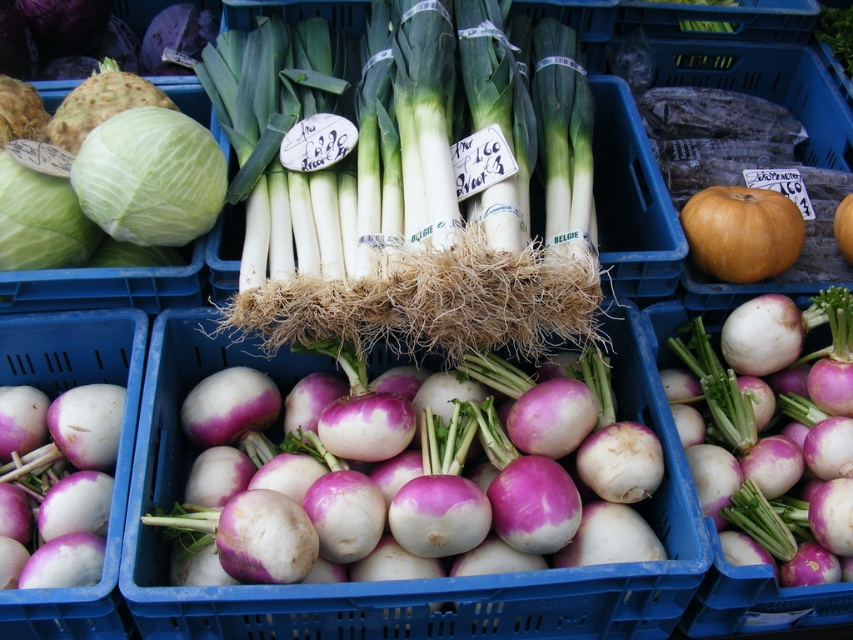
Is purple matte turnip at center closer to the viewer compared to green matte cabbage at upper left?

Yes, purple matte turnip at center is in front of green matte cabbage at upper left.

Between purple matte turnip at center and green matte cabbage at upper left, which one has less height?

Standing shorter between the two is green matte cabbage at upper left.

Is point (779, 497) more distant than point (77, 260)?

That is False.

This screenshot has width=853, height=640. I want to click on purple matte turnip at center, so pos(776,442).

Is purple matte turnip at center above matte orange pumpkin at center?

Actually, purple matte turnip at center is below matte orange pumpkin at center.

Does purple matte turnip at center have a lesser height compared to matte orange pumpkin at center?

Incorrect, purple matte turnip at center's height does not fall short of matte orange pumpkin at center's.

Does point (724, 506) come in front of point (770, 262)?

Yes, it is in front of point (770, 262).

Where is `purple matte turnip at center`? purple matte turnip at center is located at coordinates (776, 442).

Is point (93, 179) closer to viewer compared to point (699, 236)?

Yes, point (93, 179) is in front of point (699, 236).

Is smooth white cabbage at left thinner than matte orange pumpkin at center?

In fact, smooth white cabbage at left might be wider than matte orange pumpkin at center.

Does point (122, 204) lie behind point (693, 253)?

No, it is in front of (693, 253).

You are a GUI agent. You are given a task and a screenshot of the screen. Output one action in this format:
    pyautogui.click(x=<x>, y=<y>)
    Task: Click on the smooth white cabbage at left
    The width and height of the screenshot is (853, 640).
    Given the screenshot: What is the action you would take?
    pyautogui.click(x=149, y=177)